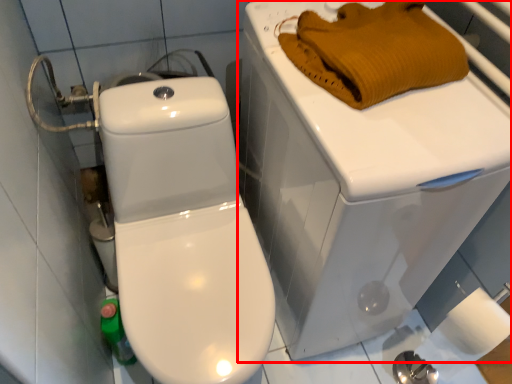
Question: From the image's perspective, what is the correct spatial positioning of porcelain (annotated by the red box) in reference to material?

Choices:
 (A) above
 (B) below

Answer: (B)